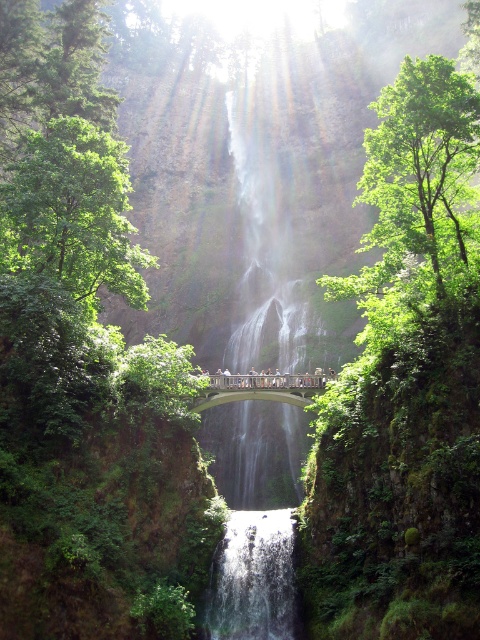
Question: Which point is closer to the camera taking this photo?

Choices:
 (A) (296, 387)
 (B) (264, 564)

Answer: (B)

Question: Can you confirm if clear water at center is smaller than wooden bridge at center?

Choices:
 (A) yes
 (B) no

Answer: (B)

Question: Which object is farther from the camera taking this photo?

Choices:
 (A) wooden bridge at center
 (B) clear water at center

Answer: (A)

Question: Considering the relative positions of clear water at center and wooden bridge at center in the image provided, where is clear water at center located with respect to wooden bridge at center?

Choices:
 (A) right
 (B) left

Answer: (B)

Question: Is the position of clear water at center more distant than that of wooden bridge at center?

Choices:
 (A) no
 (B) yes

Answer: (A)